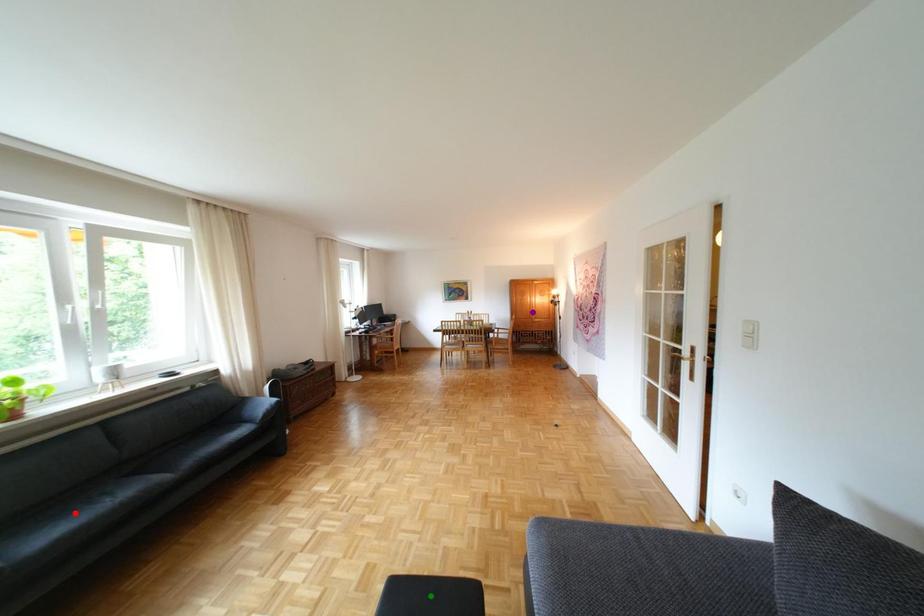
Order these from nearest to farthest:
green point, purple point, red point

1. purple point
2. green point
3. red point